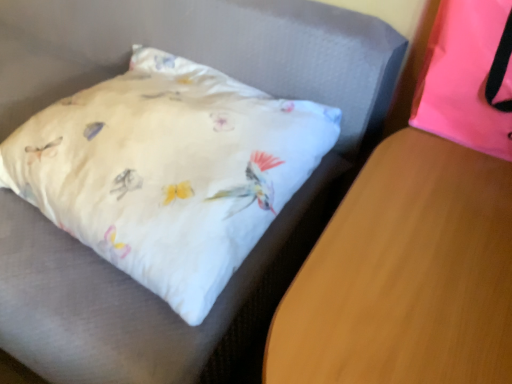
Question: From a real-world perspective, is wooden table at lower right above or below pink fabric pillow at upper right?

Choices:
 (A) above
 (B) below

Answer: (B)

Question: Considering the positions of point (478, 309) and point (452, 130), is point (478, 309) closer or farther from the camera than point (452, 130)?

Choices:
 (A) farther
 (B) closer

Answer: (B)

Question: Considering the positions of wooden table at lower right and pink fabric pillow at upper right in the image, is wooden table at lower right wider or thinner than pink fabric pillow at upper right?

Choices:
 (A) wide
 (B) thin

Answer: (A)

Question: Is pink fabric pillow at upper right wider or thinner than wooden table at lower right?

Choices:
 (A) wide
 (B) thin

Answer: (B)

Question: Which is correct: pink fabric pillow at upper right is inside wooden table at lower right, or outside of it?

Choices:
 (A) inside
 (B) outside

Answer: (B)

Question: Is point (496, 155) closer or farther from the camera than point (448, 215)?

Choices:
 (A) closer
 (B) farther

Answer: (B)

Question: From the image's perspective, is pink fabric pillow at upper right located above or below wooden table at lower right?

Choices:
 (A) below
 (B) above

Answer: (B)